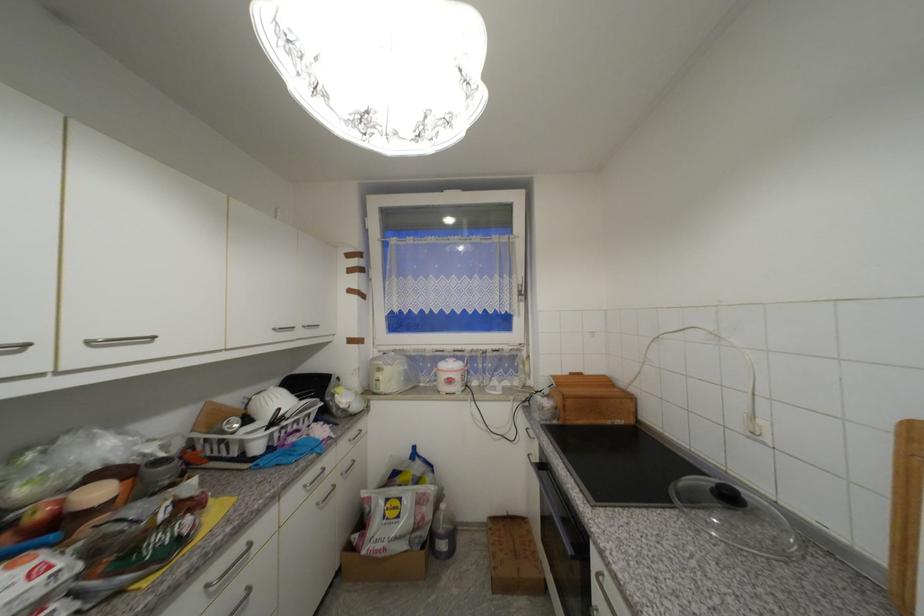
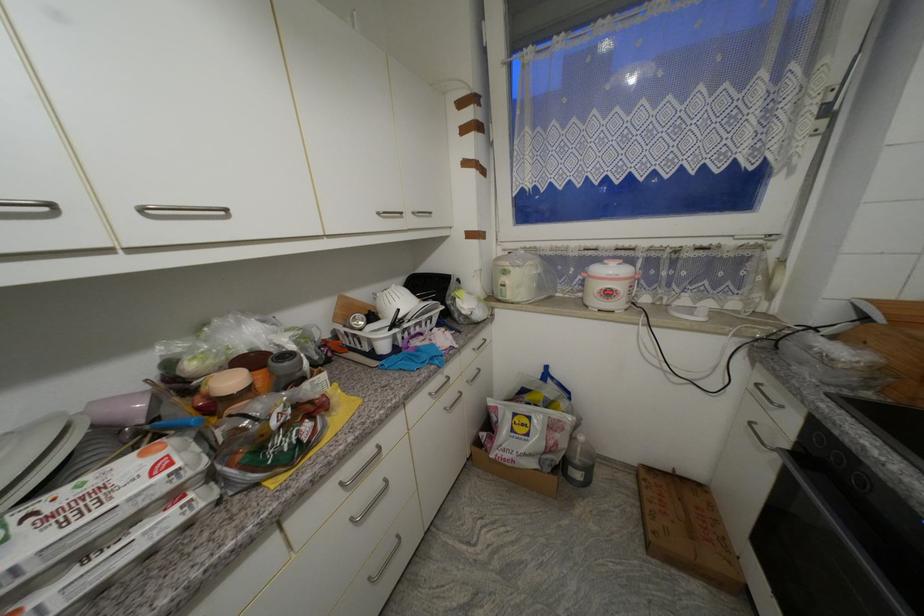
Where in the second image is the point corresponding to pixel 95 344 from the first image?

(149, 211)